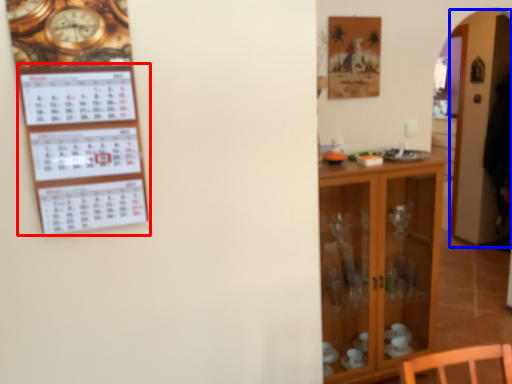
Question: Which object is closer to the camera taking this photo, bulletin board (highlighted by a red box) or glass door (highlighted by a blue box)?

Choices:
 (A) bulletin board
 (B) glass door

Answer: (A)